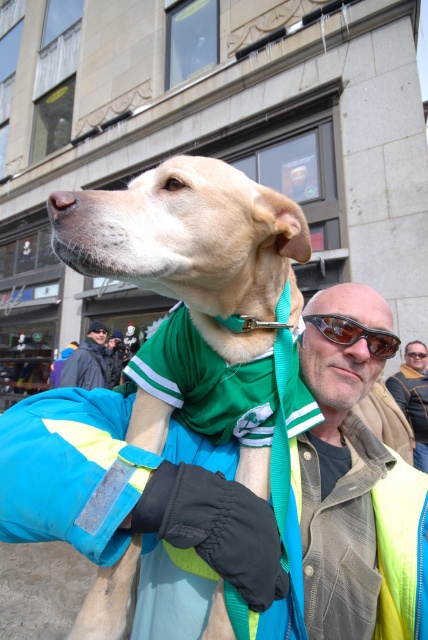
Question: Does shiny black sunglasses at center appear on the left side of sunglasses at upper center?

Choices:
 (A) yes
 (B) no

Answer: (B)

Question: Is green fabric at center positioned before sunglasses at upper center?

Choices:
 (A) yes
 (B) no

Answer: (A)

Question: Among these points, which one is nearest to the camera?

Choices:
 (A) (422, 422)
 (B) (327, 412)

Answer: (B)

Question: Can you confirm if sunglasses at center is positioned above sunglasses at upper center?

Choices:
 (A) no
 (B) yes

Answer: (A)

Question: Which object appears farthest from the camera in this image?

Choices:
 (A) sunglasses at upper center
 (B) leather jacket at center
 (C) green fabric at center

Answer: (A)

Question: Which of the following is the farthest from the observer?

Choices:
 (A) (335, 316)
 (B) (407, 355)
 (C) (422, 412)

Answer: (B)